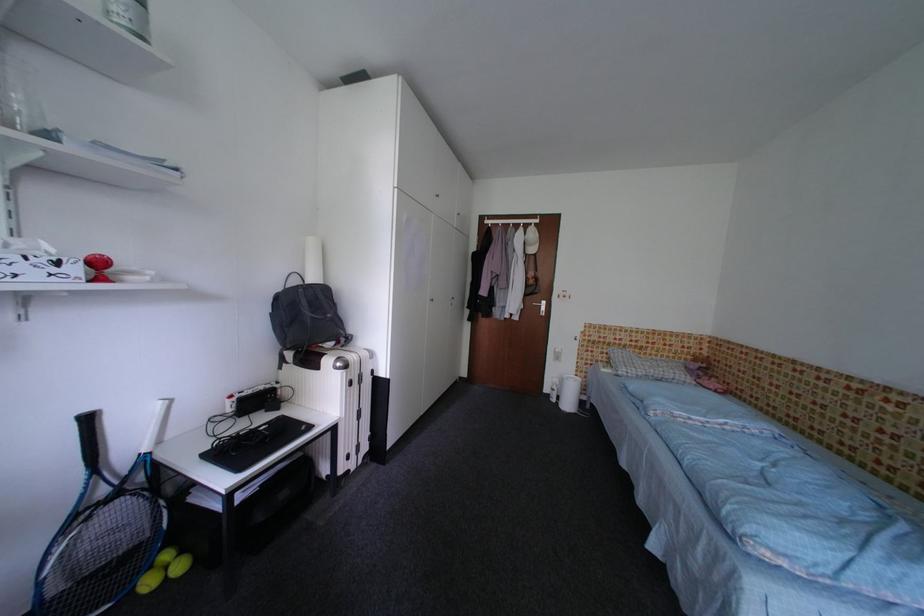
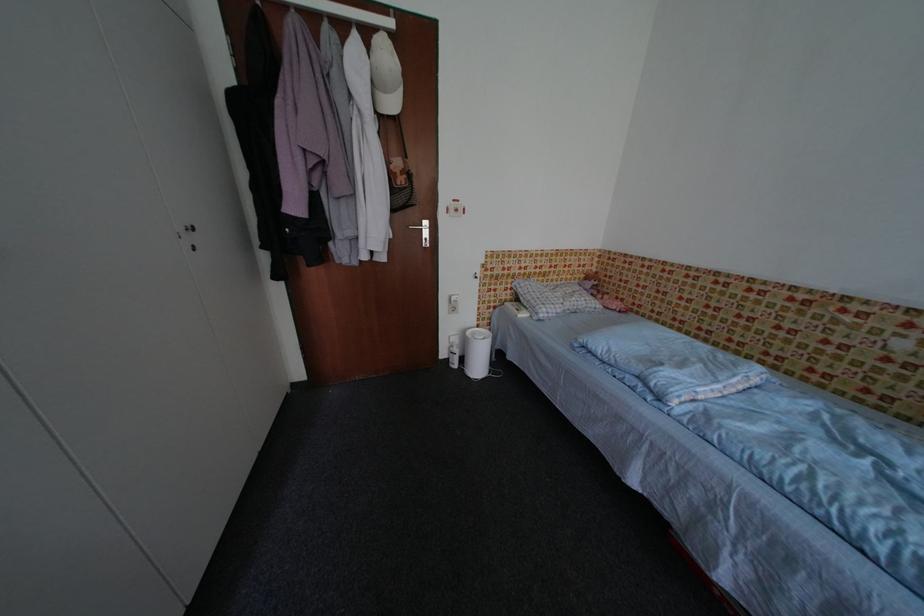
The point at [610,363] is marked in the first image. Where is the corresponding point in the second image?

(514, 302)